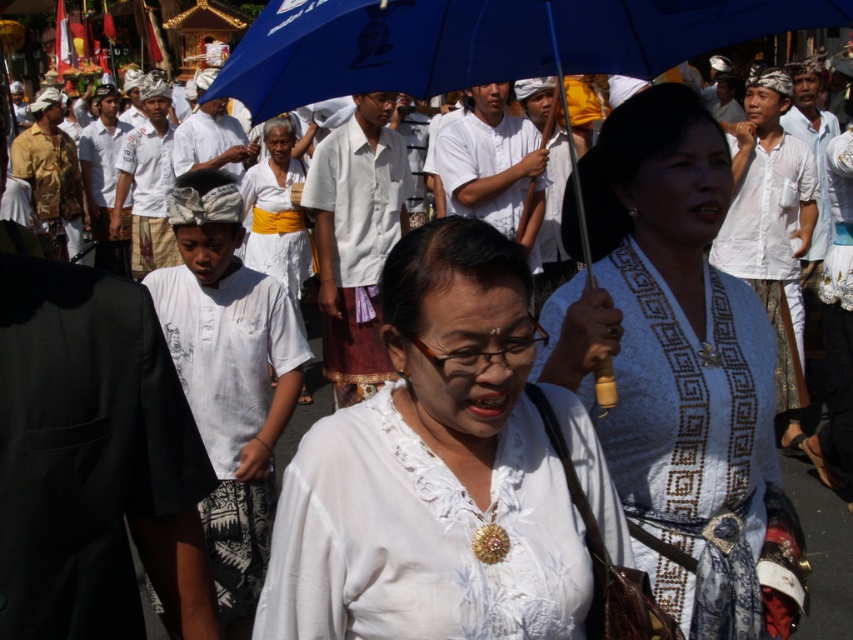
Question: Considering the relative positions of white lace blouse at center and white cotton dress at center in the image provided, where is white lace blouse at center located with respect to white cotton dress at center?

Choices:
 (A) right
 (B) left

Answer: (A)

Question: Which point is closer to the camera taking this photo?

Choices:
 (A) (381, 625)
 (B) (445, 65)

Answer: (A)

Question: Is white woven fabric at center to the left of blue fabric umbrella at upper center from the viewer's perspective?

Choices:
 (A) yes
 (B) no

Answer: (B)

Question: Which object is positioned closest to the blue fabric umbrella at upper center?

Choices:
 (A) white woven fabric at center
 (B) white cotton dress at center

Answer: (A)

Question: Does white lace blouse at center appear under white woven fabric at center?

Choices:
 (A) yes
 (B) no

Answer: (A)

Question: Which point is farther to the camera?

Choices:
 (A) (274, 253)
 (B) (318, 522)
 (C) (633, 56)
 (D) (746, 497)

Answer: (A)